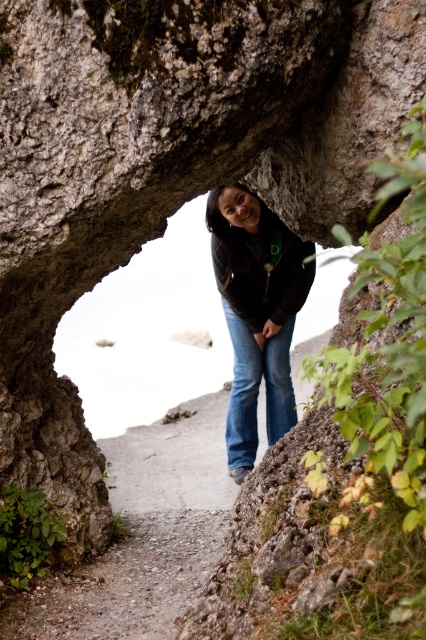
The width and height of the screenshot is (426, 640). What do you see at coordinates (143, 536) in the screenshot?
I see `smooth concrete path at center` at bounding box center [143, 536].

In the scene shown: Can you confirm if smooth concrete path at center is positioned above matte black jacket at center?

No, smooth concrete path at center is not above matte black jacket at center.

Locate an element on the screen. The height and width of the screenshot is (640, 426). smooth concrete path at center is located at coordinates (143, 536).